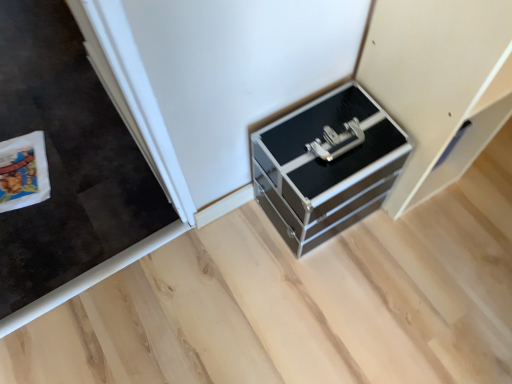
Find the location of `unoccupied region to the right of metallic silver drawer at lower right`. unoccupied region to the right of metallic silver drawer at lower right is located at coordinates (486, 185).